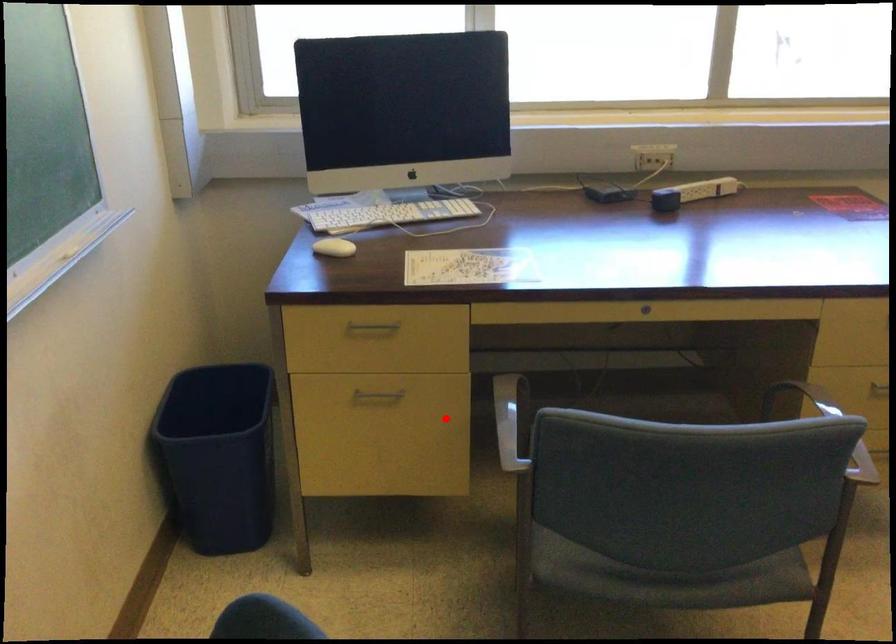
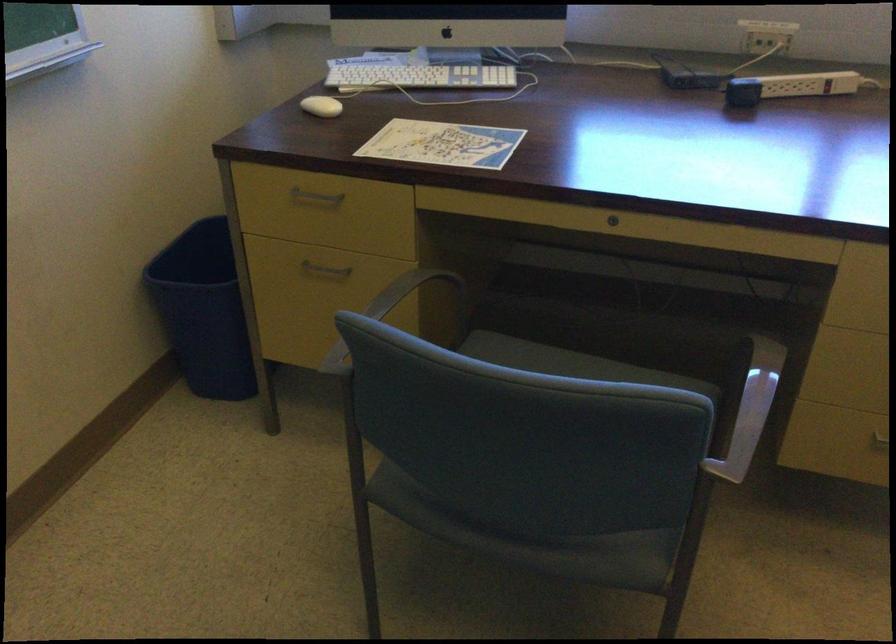
Question: I am providing you with two images of the same scene from different viewpoints. A red point is marked on the first image. Can you still see the location of the red point in image 2?

Choices:
 (A) Yes
 (B) No

Answer: (A)